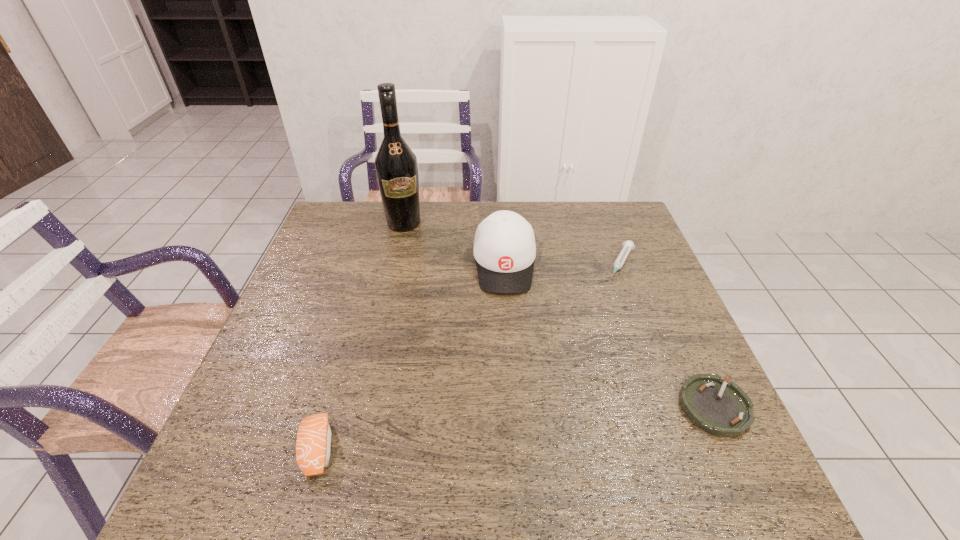
Find the location of `empty location between the ashtray and the baseball cap`. empty location between the ashtray and the baseball cap is located at coordinates (610, 336).

The height and width of the screenshot is (540, 960). In order to click on free space that is in between the ashtray and the second tallest object in this screenshot , I will do `click(610, 336)`.

I want to click on free space between the third shortest object and the third object from right to left, so click(411, 356).

Identify which object is the third closest to the ashtray. Please provide its 2D coordinates. Your answer should be formatted as a tuple, i.e. [(x, y)], where the tuple contains the x and y coordinates of a point satisfying the conditions above.

[(313, 443)]

Identify the location of object that is the third nearest to the third object from right to left. This screenshot has width=960, height=540. (722, 409).

Locate an element on the screen. This screenshot has height=540, width=960. free space that satisfies the following two spatial constraints: 1. on the back side of the third shortest object; 2. on the right side of the ashtray is located at coordinates (330, 407).